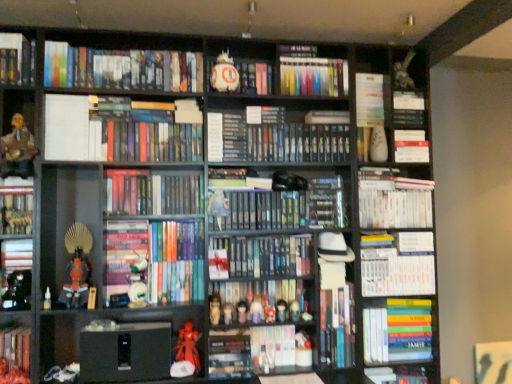
Question: Is hardcover books at upper left, which appears as the 21th book when ordered from the bottom, to the left of hardcover book at center, the 21th book positioned from the top, from the viewer's perspective?

Choices:
 (A) no
 (B) yes

Answer: (B)

Question: Can you confirm if hardcover books at upper left, which appears as the 21th book when ordered from the bottom, is thinner than hardcover book at center, the 3th book positioned from the bottom?

Choices:
 (A) yes
 (B) no

Answer: (A)

Question: From the image's perspective, would you say hardcover books at upper left, which appears as the 21th book when ordered from the bottom, is shown under hardcover book at center, the 21th book positioned from the top?

Choices:
 (A) yes
 (B) no

Answer: (B)

Question: Does hardcover books at upper left, which appears as the 21th book when ordered from the bottom, have a greater height compared to hardcover book at center, the 3th book positioned from the bottom?

Choices:
 (A) no
 (B) yes

Answer: (B)

Question: Considering the relative sizes of hardcover books at upper left, placed as the 3th book when sorted from top to bottom, and hardcover book at center, the 21th book positioned from the top, in the image provided, is hardcover books at upper left, placed as the 3th book when sorted from top to bottom, smaller than hardcover book at center, the 21th book positioned from the top,?

Choices:
 (A) no
 (B) yes

Answer: (A)

Question: Is smooth plastic figurine at center, which is the 11th toy from left to right, in front of or behind orange fabric figurine at lower left, acting as the tenth toy starting from the right, in the image?

Choices:
 (A) behind
 (B) front

Answer: (A)

Question: From a real-world perspective, is smooth plastic figurine at center, which is the 11th toy from left to right, above or below orange fabric figurine at lower left, the third toy in the left-to-right sequence?

Choices:
 (A) below
 (B) above

Answer: (A)

Question: Considering the relative positions of smooth plastic figurine at center, arranged as the 2th toy when viewed from the right, and orange fabric figurine at lower left, acting as the tenth toy starting from the right, in the image provided, is smooth plastic figurine at center, arranged as the 2th toy when viewed from the right, to the left or to the right of orange fabric figurine at lower left, acting as the tenth toy starting from the right,?

Choices:
 (A) right
 (B) left

Answer: (A)

Question: In terms of height, does smooth plastic figurine at center, which is the 11th toy from left to right, look taller or shorter compared to orange fabric figurine at lower left, the third toy in the left-to-right sequence?

Choices:
 (A) short
 (B) tall

Answer: (A)

Question: Considering the positions of white matte book at upper right, the fourth book in the top-to-bottom sequence, and matte plastic figurine at center, positioned as the fourth toy in right-to-left order, in the image, is white matte book at upper right, the fourth book in the top-to-bottom sequence, wider or thinner than matte plastic figurine at center, positioned as the fourth toy in right-to-left order,?

Choices:
 (A) thin
 (B) wide

Answer: (B)

Question: Is point (415, 122) positioned closer to the camera than point (239, 311)?

Choices:
 (A) closer
 (B) farther

Answer: (B)

Question: Relative to matte plastic figurine at center, acting as the ninth toy starting from the left, is white matte book at upper right, the fourth book in the top-to-bottom sequence, in front or behind?

Choices:
 (A) behind
 (B) front

Answer: (A)

Question: In the image, is white matte book at upper right, the twentieth book from the bottom, on the left side or the right side of matte plastic figurine at center, positioned as the fourth toy in right-to-left order?

Choices:
 (A) right
 (B) left

Answer: (A)

Question: Is matte brown leather jacket at left situated inside matte plastic figurine at center, the sixth toy positioned from the right, or outside?

Choices:
 (A) inside
 (B) outside

Answer: (B)

Question: Considering the positions of matte brown leather jacket at left and matte plastic figurine at center, the sixth toy positioned from the right, in the image, is matte brown leather jacket at left wider or thinner than matte plastic figurine at center, the sixth toy positioned from the right,?

Choices:
 (A) thin
 (B) wide

Answer: (B)